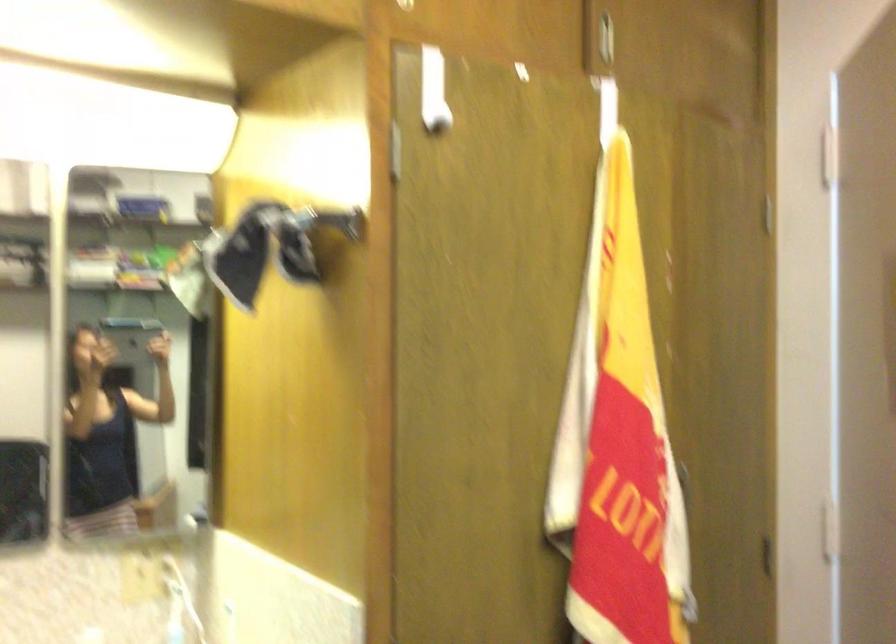
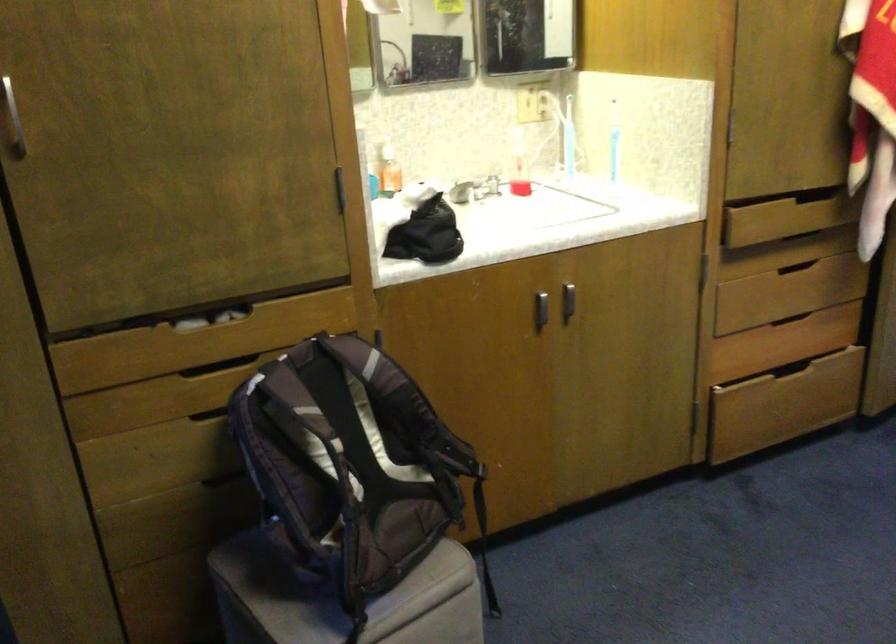
Question: What movement of the cameraman would produce the second image?

Choices:
 (A) Left
 (B) Right
 (C) Forward
 (D) Backward

Answer: (D)